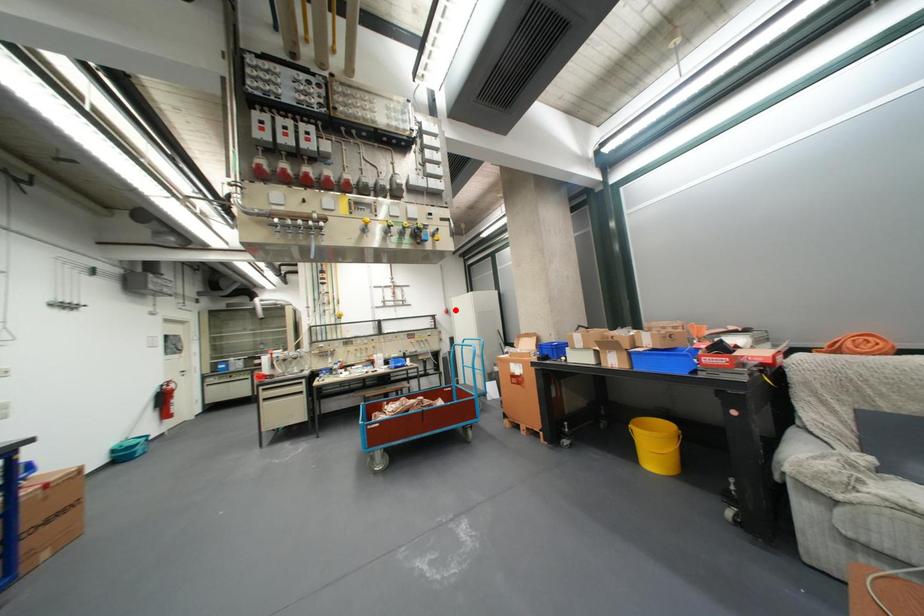
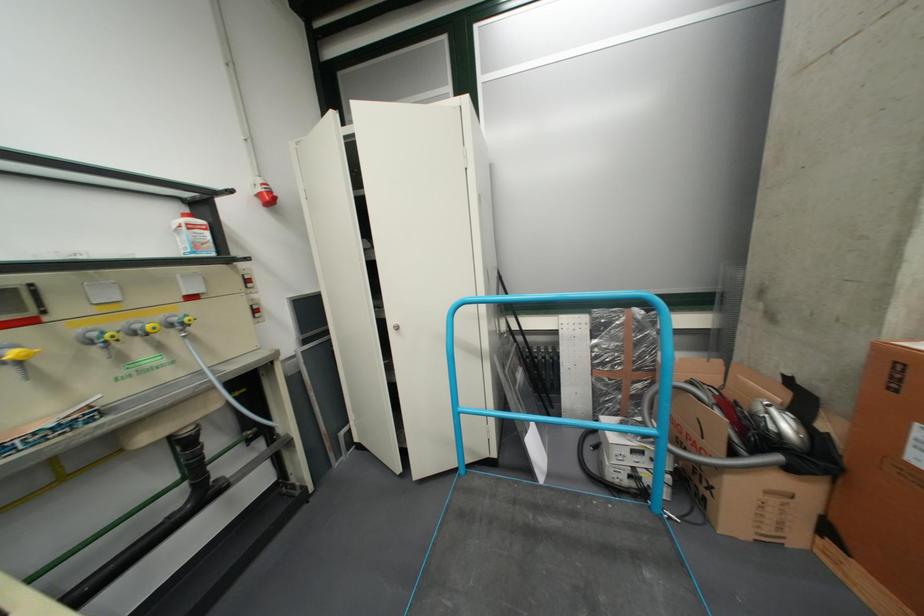
The point at the highlighted location is marked in the first image. Where is the corresponding point in the second image?

(260, 185)